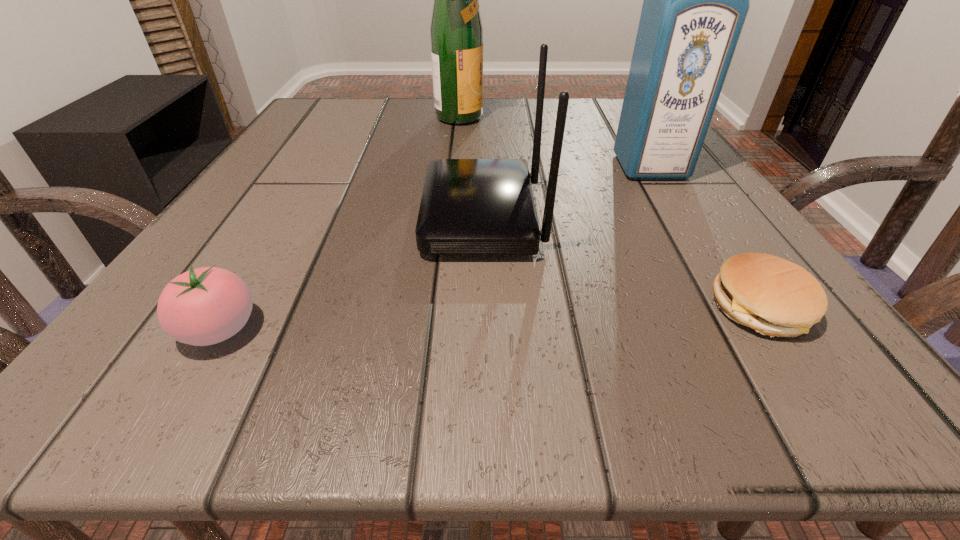
You are a GUI agent. You are given a task and a screenshot of the screen. Output one action in this format:
    pyautogui.click(x=<x>, y=<y>)
    Task: Click on the left liquor
    The image size is (960, 540).
    Given the screenshot: What is the action you would take?
    pyautogui.click(x=456, y=31)

Where is `the farthest object`? the farthest object is located at coordinates (456, 31).

Find the location of a particular element. the right liquor is located at coordinates (696, 0).

The height and width of the screenshot is (540, 960). I want to click on the third shortest object, so [x=469, y=206].

In order to click on the fourth tallest object in this screenshot , I will do `click(204, 306)`.

At what (x,y) coordinates should I click in order to perform the action: click on the leftmost object. Please return your answer as a coordinate pair (x, y). This screenshot has width=960, height=540. Looking at the image, I should click on (204, 306).

Locate an element on the screen. This screenshot has height=540, width=960. the shortest object is located at coordinates (776, 297).

Where is `vacant space located 0.320m on the front-facing side of the farthest object`? The width and height of the screenshot is (960, 540). vacant space located 0.320m on the front-facing side of the farthest object is located at coordinates (637, 120).

The height and width of the screenshot is (540, 960). What are the coordinates of `vacant space situated 0.150m on the flat label side of the nearer liquor` in the screenshot? It's located at (692, 234).

Identify the location of vacant position located on the front-facing side of the router. This screenshot has height=540, width=960. (317, 217).